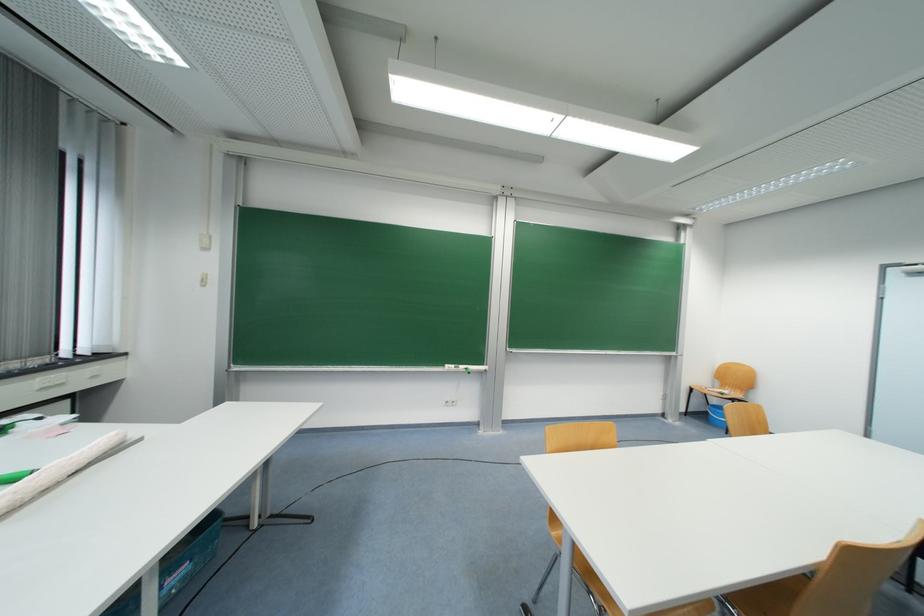
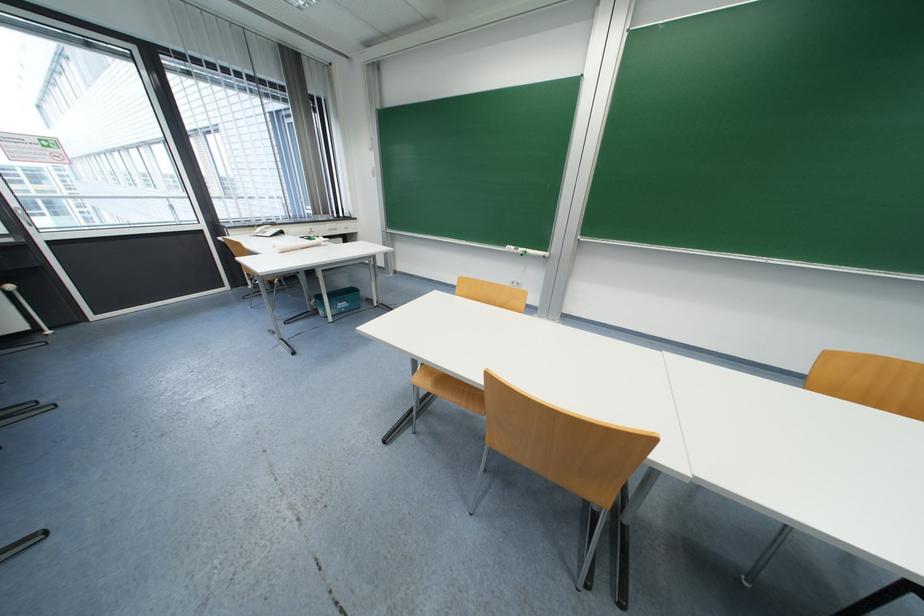
The point at (188, 581) is marked in the first image. Where is the corresponding point in the second image?

(350, 310)